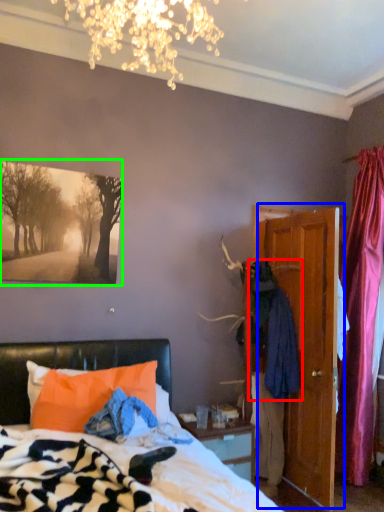
Question: Based on their relative distances, which object is nearer to clothing (highlighted by a red box)? Choose from door (highlighted by a blue box) and picture frame (highlighted by a green box).

Choices:
 (A) door
 (B) picture frame

Answer: (A)